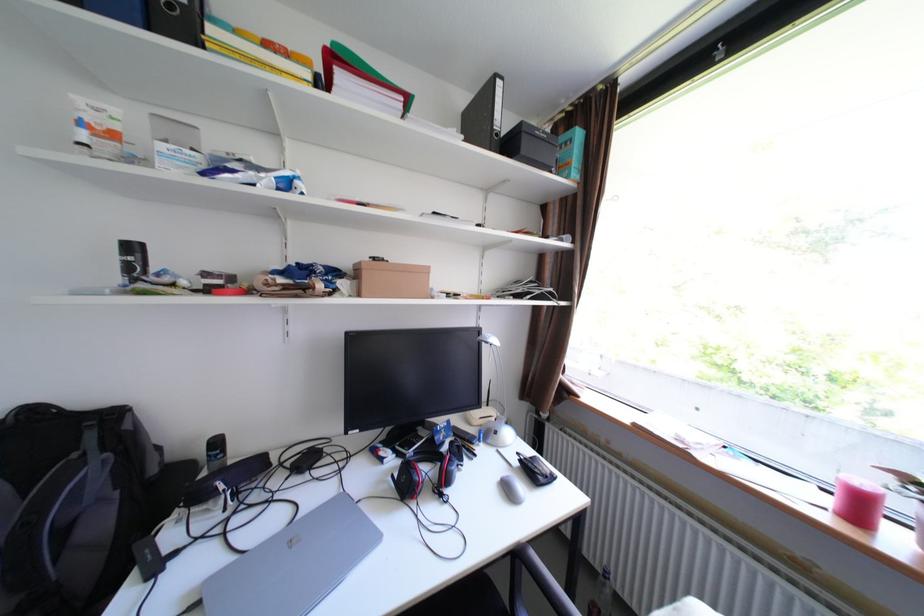
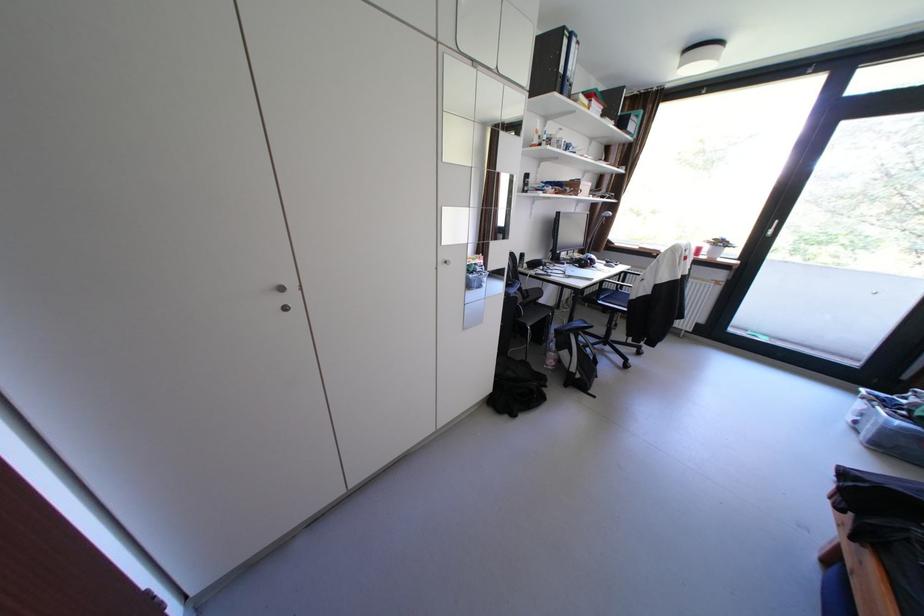
The point at (392,461) is marked in the first image. Where is the corresponding point in the second image?

(574, 264)